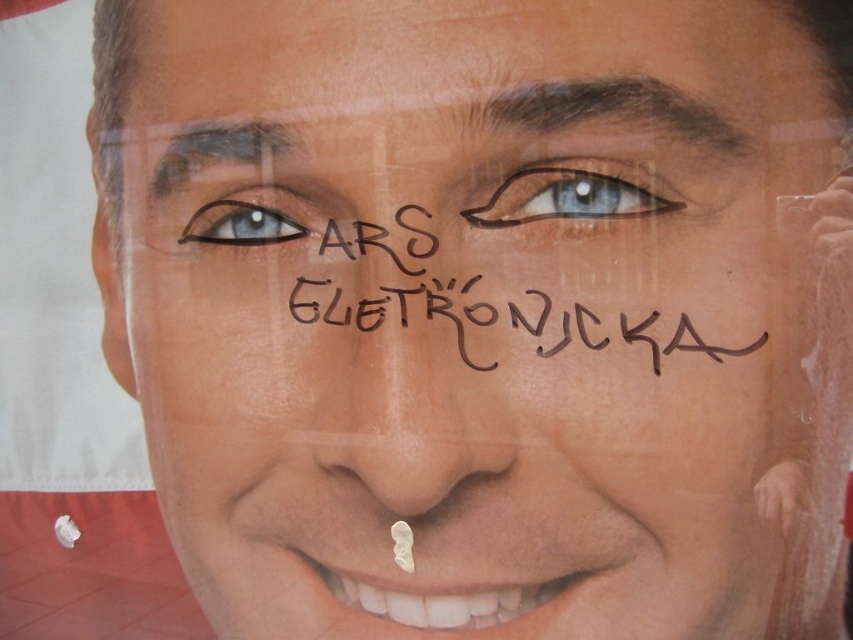
Based on the scene description, which object has a greater width between the blue matte eye at upper center and the smooth skin at upper center?

The blue matte eye at upper center has a greater width than the smooth skin at upper center according to the description.

Based on the photo, based on the scene description, which object is shorter, the brown hair at upper center or the smooth skin at upper center?

The brown hair at upper center is shorter than the smooth skin at upper center.

You are an artist trying to recreate the poster. The original poster has a point marked at coordinates (x=618, y=112). Based on the scene description, what feature is located at that point?

The point at (x=618, y=112) corresponds to the brown hair at upper center.